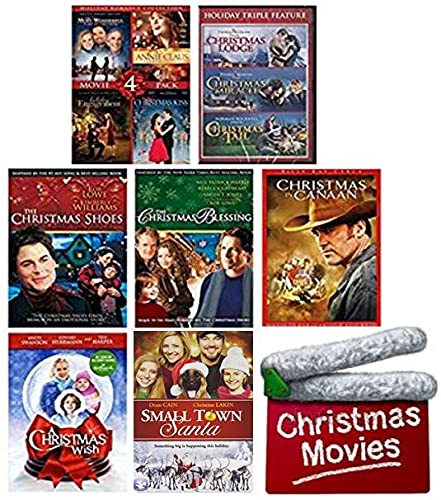
Locate an element on the screen. The image size is (441, 500). dvd is located at coordinates (133, 111), (246, 105), (98, 215), (193, 206), (290, 211), (61, 354), (198, 361).